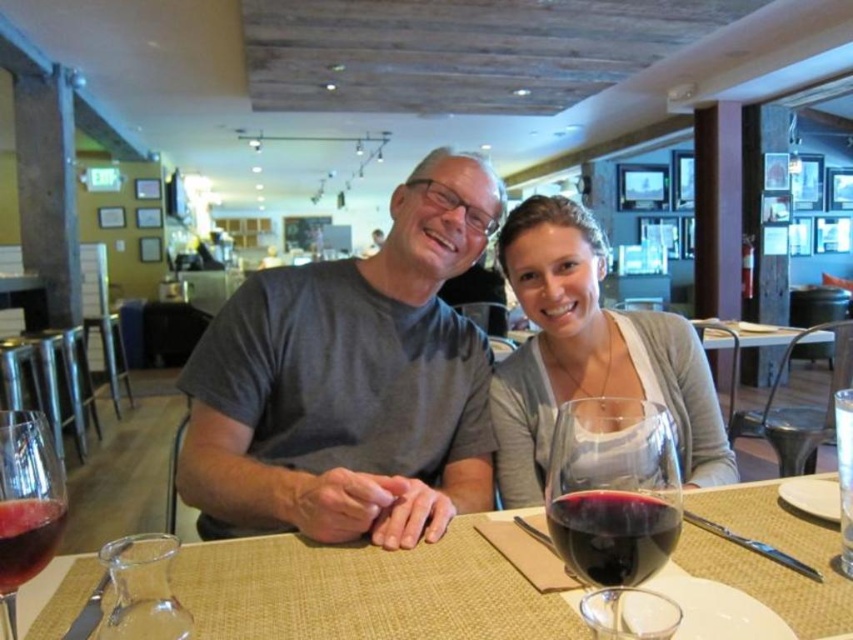
Between gray matte t-shirt at center and translucent glass table at center, which one is positioned higher?

Positioned higher is gray matte t-shirt at center.

Who is more forward, (258, 509) or (808, 580)?

Point (808, 580)

Locate an element on the screen. gray matte t-shirt at center is located at coordinates (x=350, y=381).

Who is higher up, gray matte t-shirt at center or translucent glass wine at center?

gray matte t-shirt at center

Who is lower down, gray matte t-shirt at center or translucent glass wine at center?

translucent glass wine at center is lower down.

Where is `gray matte t-shirt at center`? gray matte t-shirt at center is located at coordinates (350, 381).

Is point (376, 637) less distant than point (671, 531)?

No.

Is translucent glass table at center bigger than shiny dark red wine at table center?

Indeed, translucent glass table at center has a larger size compared to shiny dark red wine at table center.

Is point (503, 632) farther from camera compared to point (672, 548)?

Yes, point (503, 632) is behind point (672, 548).

This screenshot has width=853, height=640. Find the location of `translucent glass table at center`. translucent glass table at center is located at coordinates (364, 593).